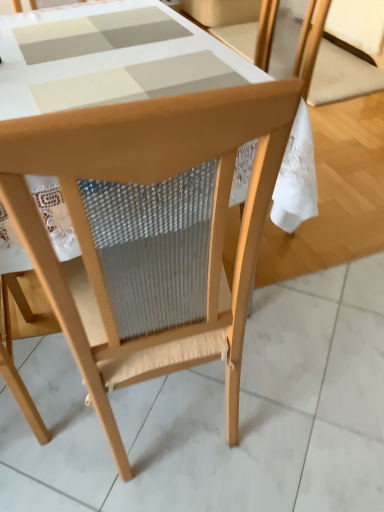
Question: Can you confirm if wooden chair at upper right, positioned as the first chair in right-to-left order, is taller than natural wood chair at center, the 1th chair in the front-to-back sequence?

Choices:
 (A) no
 (B) yes

Answer: (A)

Question: Does wooden chair at upper right, placed as the 1th chair when sorted from back to front, have a lesser height compared to natural wood chair at center, marked as the 2th chair in a top-to-bottom arrangement?

Choices:
 (A) yes
 (B) no

Answer: (A)

Question: Does wooden chair at upper right, which is counted as the second chair, starting from the front, have a greater width compared to natural wood chair at center, marked as the 2th chair in a top-to-bottom arrangement?

Choices:
 (A) no
 (B) yes

Answer: (B)

Question: Does wooden chair at upper right, which ranks as the second chair in left-to-right order, have a smaller size compared to natural wood chair at center, the second chair from the back?

Choices:
 (A) no
 (B) yes

Answer: (B)

Question: Is wooden chair at upper right, which is counted as the second chair, starting from the front, at the right side of natural wood chair at center, marked as the 2th chair in a top-to-bottom arrangement?

Choices:
 (A) no
 (B) yes

Answer: (B)

Question: From a real-world perspective, is wooden chair at upper right, acting as the second chair starting from the bottom, beneath natural wood chair at center, the second chair from the back?

Choices:
 (A) yes
 (B) no

Answer: (A)

Question: Considering the relative positions of natural wood chair at center, marked as the 2th chair in a top-to-bottom arrangement, and wooden chair at upper right, which is counted as the second chair, starting from the front, in the image provided, is natural wood chair at center, marked as the 2th chair in a top-to-bottom arrangement, to the left of wooden chair at upper right, which is counted as the second chair, starting from the front, from the viewer's perspective?

Choices:
 (A) no
 (B) yes

Answer: (B)

Question: Is the depth of natural wood chair at center, the second chair from the back, less than that of wooden chair at upper right, placed as the 1th chair when sorted from top to bottom?

Choices:
 (A) yes
 (B) no

Answer: (A)

Question: From a real-world perspective, is natural wood chair at center, placed as the 2th chair when sorted from right to left, on top of wooden chair at upper right, placed as the 1th chair when sorted from top to bottom?

Choices:
 (A) yes
 (B) no

Answer: (A)

Question: Considering the relative positions of natural wood chair at center, the second chair from the back, and wooden chair at upper right, which is counted as the second chair, starting from the front, in the image provided, is natural wood chair at center, the second chair from the back, to the right of wooden chair at upper right, which is counted as the second chair, starting from the front, from the viewer's perspective?

Choices:
 (A) yes
 (B) no

Answer: (B)

Question: Considering the relative sizes of natural wood chair at center, the second chair from the back, and wooden chair at upper right, placed as the 1th chair when sorted from top to bottom, in the image provided, is natural wood chair at center, the second chair from the back, smaller than wooden chair at upper right, placed as the 1th chair when sorted from top to bottom,?

Choices:
 (A) yes
 (B) no

Answer: (B)

Question: Can you confirm if natural wood chair at center, the second chair from the back, is taller than wooden chair at upper right, placed as the 1th chair when sorted from top to bottom?

Choices:
 (A) no
 (B) yes

Answer: (B)

Question: From the image's perspective, relative to natural wood chair at center, the second chair from the back, is wooden chair at upper right, which ranks as the second chair in left-to-right order, above or below?

Choices:
 (A) above
 (B) below

Answer: (A)